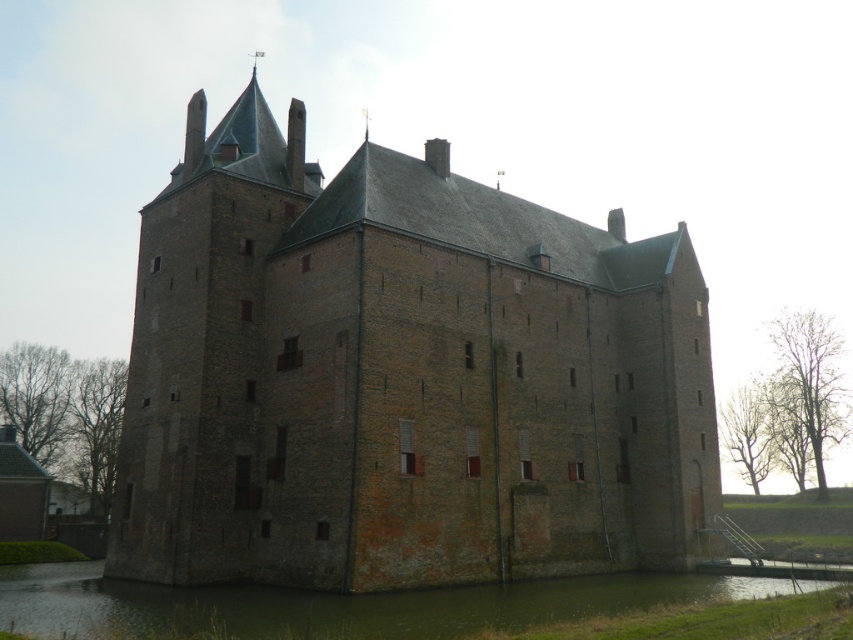
Is brown brick castle at center smaller than green grassy bank at lower center?

No.

Measure the distance from brown brick castle at center to green grassy bank at lower center.

The distance of brown brick castle at center from green grassy bank at lower center is 48.04 feet.

Find the location of `brown brick castle at center`. brown brick castle at center is located at coordinates (401, 376).

You are a GUI agent. You are given a task and a screenshot of the screen. Output one action in this format:
    pyautogui.click(x=<x>, y=<y>)
    Task: Click on the brown brick castle at center
    Image resolution: width=853 pixels, height=640 pixels.
    Given the screenshot: What is the action you would take?
    pyautogui.click(x=401, y=376)